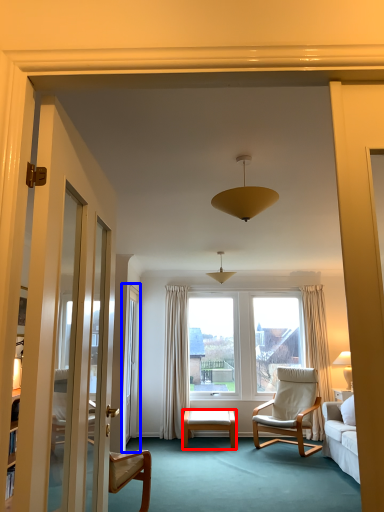
Question: Which object is further to the camera taking this photo, desk (highlighted by a red box) or screen door (highlighted by a blue box)?

Choices:
 (A) desk
 (B) screen door

Answer: (A)